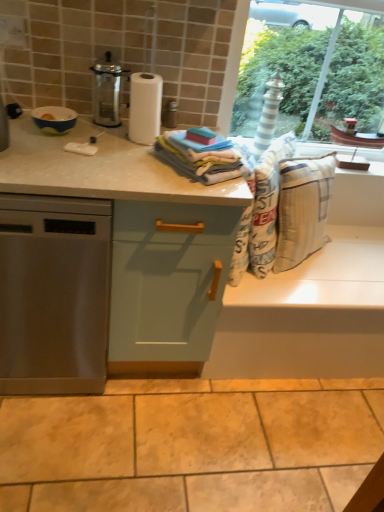
Identify the location of vacant area that is in front of matte ceramic bowl at upper left. This screenshot has width=384, height=512. (39, 151).